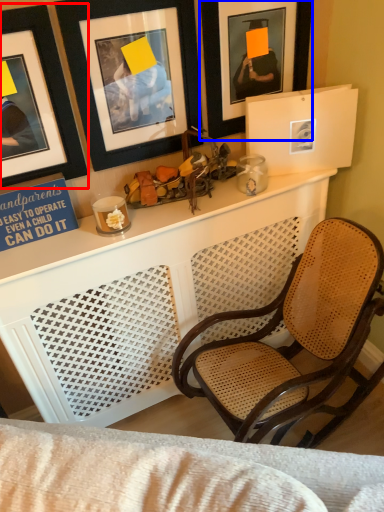
Question: Which of the following is the farthest to the observer, picture frame (highlighted by a red box) or picture frame (highlighted by a blue box)?

Choices:
 (A) picture frame
 (B) picture frame

Answer: (B)